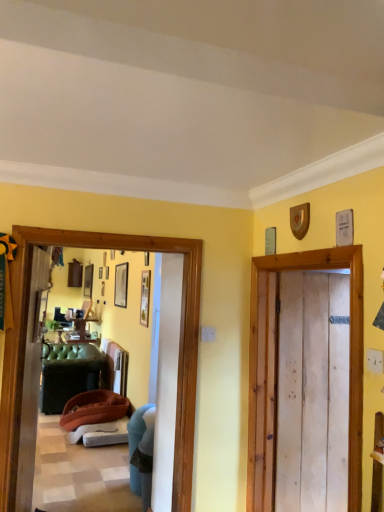
Question: In the image, is matte black picture frame at upper center, acting as the first picture frame starting from the back, on the left side or the right side of teal fabric chair at lower left?

Choices:
 (A) left
 (B) right

Answer: (A)

Question: Considering the positions of point (125, 286) and point (144, 506), is point (125, 286) closer or farther from the camera than point (144, 506)?

Choices:
 (A) farther
 (B) closer

Answer: (A)

Question: Estimate the real-world distances between objects in this image. Which object is farther from the natural wood door at right?

Choices:
 (A) green fabric couch at left
 (B) brown fabric couch at left
 (C) wooden picture frame at center, which is the 1th picture frame from front to back
 (D) teal fabric chair at lower left
 (E) matte black picture frame at upper center, the 1th picture frame positioned from the left

Answer: (E)

Question: Estimate the real-world distances between objects in this image. Which object is closer to the green fabric couch at left?

Choices:
 (A) wooden picture frame at center, positioned as the first picture frame in right-to-left order
 (B) natural wood door at right
 (C) brown fabric couch at left
 (D) matte black picture frame at upper center, the 2th picture frame viewed from the front
 (E) teal fabric chair at lower left

Answer: (E)